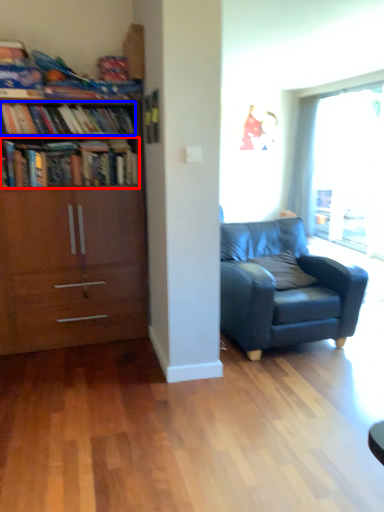
Question: Which object is further to the camera taking this photo, book (highlighted by a red box) or book (highlighted by a blue box)?

Choices:
 (A) book
 (B) book

Answer: (B)